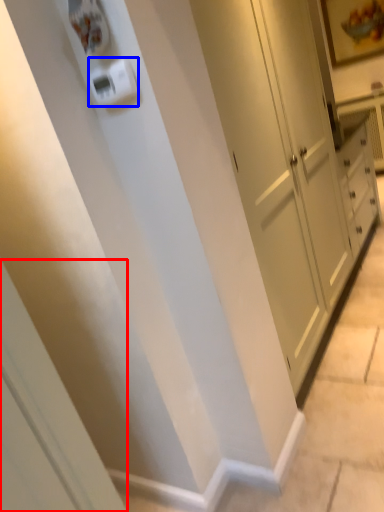
Question: Which object appears farthest to the camera in this image, screen door (highlighted by a red box) or light switch (highlighted by a blue box)?

Choices:
 (A) screen door
 (B) light switch

Answer: (B)